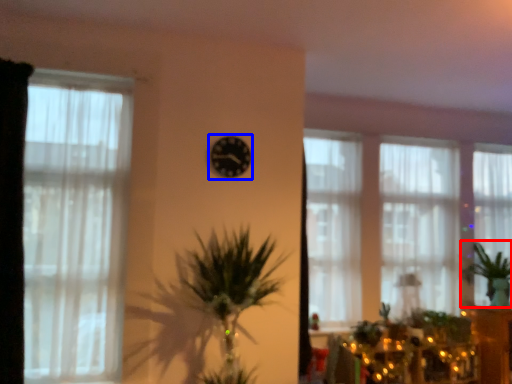
Question: Which object appears closest to the camera in this image, plant (highlighted by a red box) or clock (highlighted by a blue box)?

Choices:
 (A) plant
 (B) clock

Answer: (B)